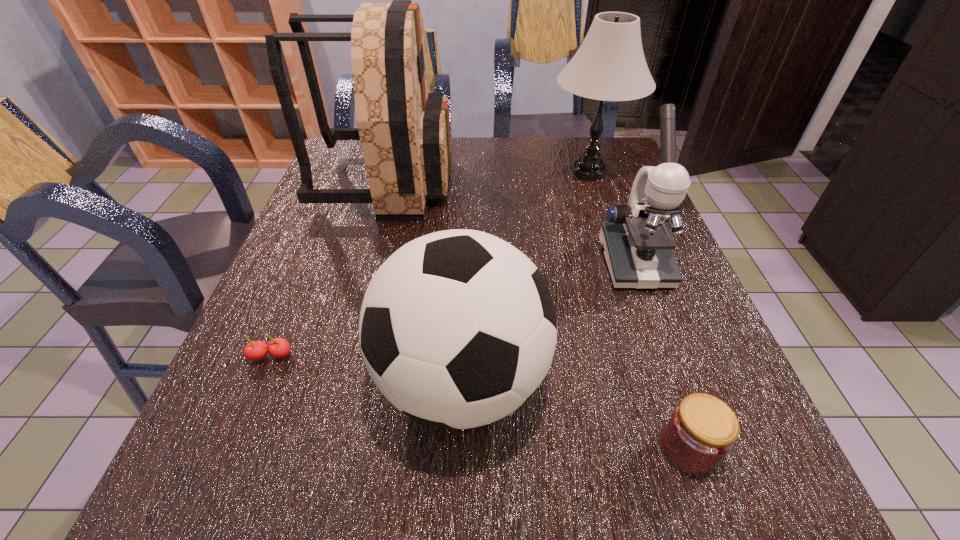
The width and height of the screenshot is (960, 540). I want to click on free space between the microscope and the backpack, so click(x=511, y=222).

Identify the location of unoccupied position between the backpack and the lamp. The width and height of the screenshot is (960, 540). (488, 178).

Locate an element on the screen. This screenshot has height=540, width=960. blank region between the fifth tallest object and the lamp is located at coordinates (638, 310).

Locate an element on the screen. The width and height of the screenshot is (960, 540). the second closest object to the backpack is located at coordinates (458, 328).

Identify the location of object that ranks as the third closest to the fourth nearest object. This screenshot has height=540, width=960. (701, 431).

Find the location of a particular element. vacant region that satisfies the following two spatial constraints: 1. on the front face of the backpack; 2. on the back side of the jam is located at coordinates (313, 448).

The height and width of the screenshot is (540, 960). In order to click on vacant space that satisfies the following two spatial constraints: 1. on the back side of the soccer ball; 2. on the front face of the backpack in this screenshot , I will do `click(468, 183)`.

Locate an element on the screen. The image size is (960, 540). vacant region that satisfies the following two spatial constraints: 1. on the front face of the backpack; 2. on the right side of the soccer ball is located at coordinates (331, 381).

Where is `free location that satisfies the following two spatial constraints: 1. on the front face of the microscope; 2. on the right side of the backpack`? The height and width of the screenshot is (540, 960). free location that satisfies the following two spatial constraints: 1. on the front face of the microscope; 2. on the right side of the backpack is located at coordinates (365, 262).

Find the location of `vacant space that satisfies the following two spatial constraints: 1. on the back side of the third farthest object; 2. on the front face of the backpack`. vacant space that satisfies the following two spatial constraints: 1. on the back side of the third farthest object; 2. on the front face of the backpack is located at coordinates (605, 183).